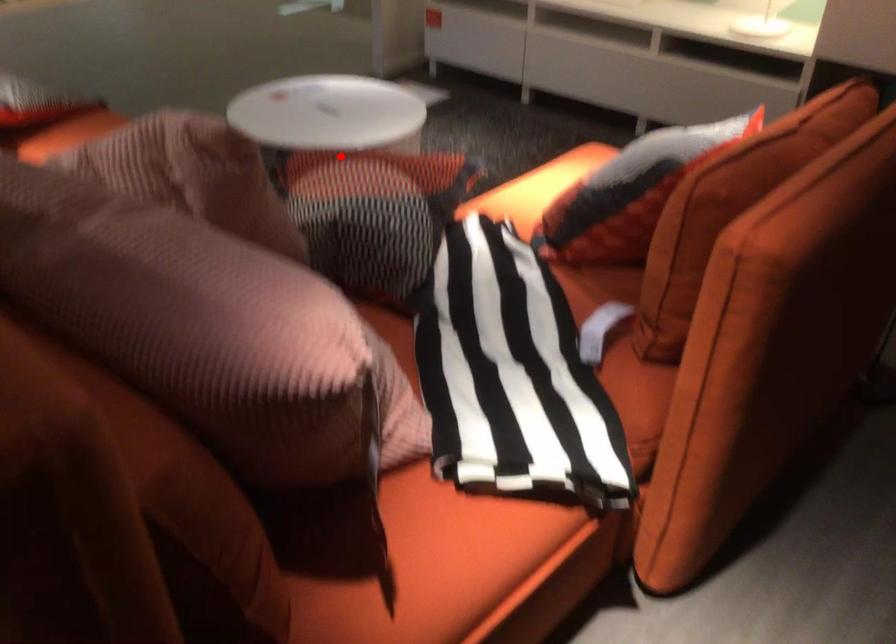
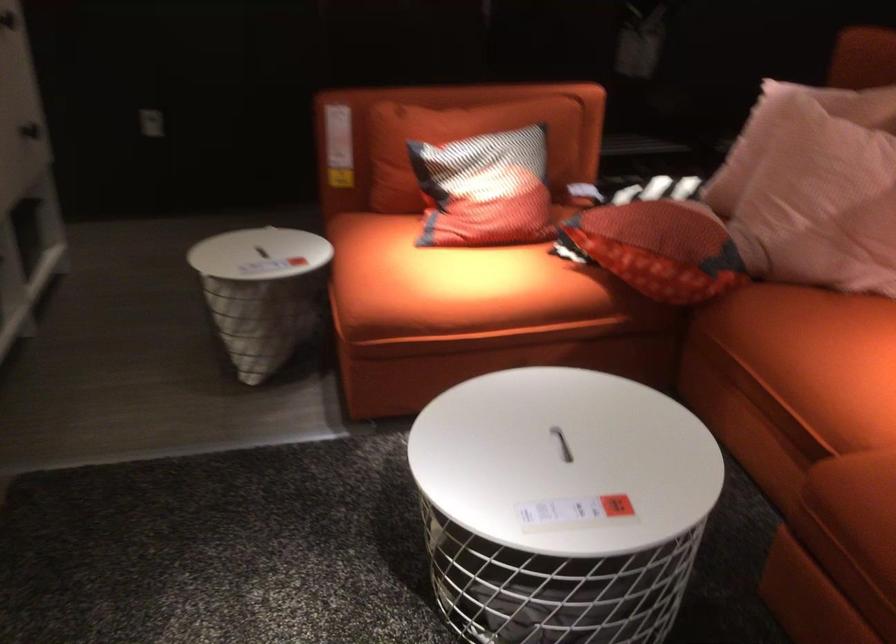
Question: I am providing you with two images of the same scene from different viewpoints. In image1, a red point is highlighted. Considering the same 3D point in image2, which of the following is correct?

Choices:
 (A) It is closer
 (B) It is farther

Answer: (B)